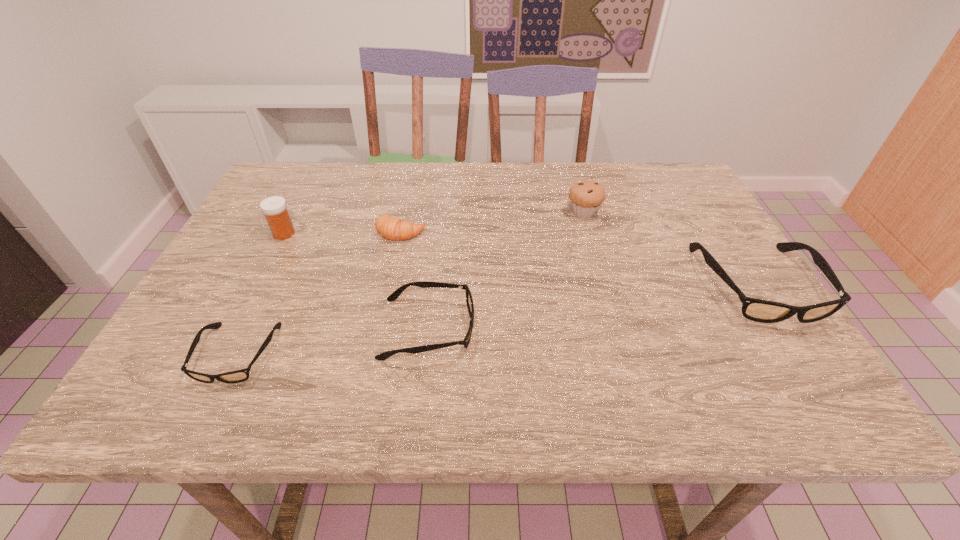
In order to click on free point between the second tallest spectacles and the medicine in this screenshot , I will do `click(356, 281)`.

Point out which object is positioned as the nearest to the rightmost object. Please provide its 2D coordinates. Your answer should be formatted as a tuple, i.e. [(x, y)], where the tuple contains the x and y coordinates of a point satisfying the conditions above.

[(586, 196)]

Identify which object is the fifth closest to the crescent roll. Please provide its 2D coordinates. Your answer should be formatted as a tuple, i.e. [(x, y)], where the tuple contains the x and y coordinates of a point satisfying the conditions above.

[(758, 310)]

The height and width of the screenshot is (540, 960). Find the location of `the closest spectacles relative to the second spectacles from right to left`. the closest spectacles relative to the second spectacles from right to left is located at coordinates (237, 376).

The height and width of the screenshot is (540, 960). Identify the location of the closest spectacles to the second spectacles from left to right. (237, 376).

This screenshot has width=960, height=540. I want to click on vacant space that satisfies the following two spatial constraints: 1. on the back side of the medicine; 2. on the right side of the crescent roll, so click(285, 231).

Locate an element on the screen. The height and width of the screenshot is (540, 960). free space that satisfies the following two spatial constraints: 1. on the front-facing side of the third tallest object; 2. on the front-facing side of the second tallest spectacles is located at coordinates (x=784, y=329).

Locate an element on the screen. The width and height of the screenshot is (960, 540). free location that satisfies the following two spatial constraints: 1. on the front-facing side of the tallest spectacles; 2. on the front-facing side of the second shortest spectacles is located at coordinates (784, 329).

Identify the location of free space that satisfies the following two spatial constraints: 1. on the front-facing side of the tallest spectacles; 2. on the front-facing side of the second spectacles from right to left. The height and width of the screenshot is (540, 960). (784, 329).